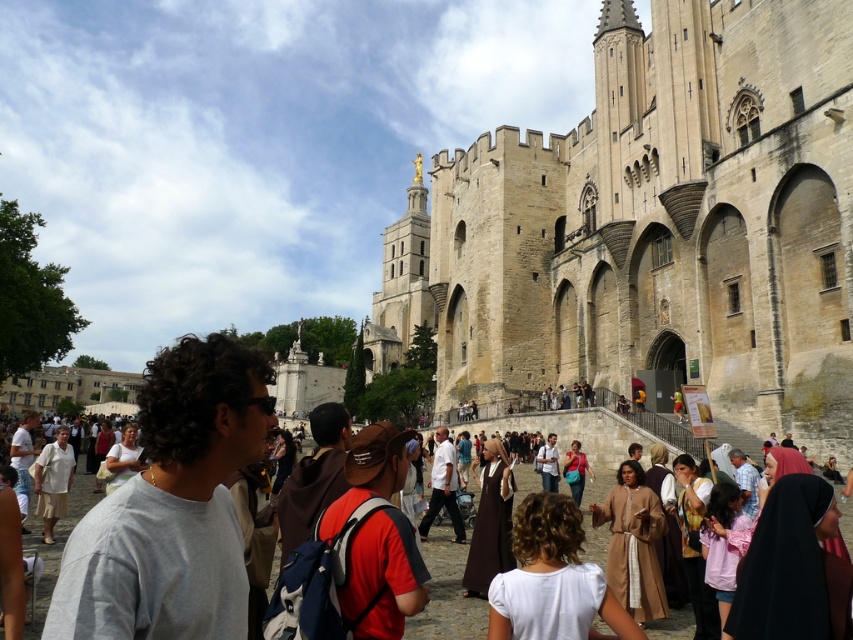
Which is above, beige stone church at center or gray cotton t-shirt at center?

beige stone church at center is higher up.

Is beige stone church at center bigger than gray cotton t-shirt at center?

Yes, beige stone church at center is bigger than gray cotton t-shirt at center.

Does point (675, 180) come farther from viewer compared to point (160, 522)?

Yes, it is.

Find the location of a particular element. This screenshot has width=853, height=640. beige stone church at center is located at coordinates (656, 227).

Who is higher up, gray cotton t-shirt at center or matte red dress at center?

gray cotton t-shirt at center

In the scene shown: Is the position of gray cotton t-shirt at center more distant than that of matte red dress at center?

No, gray cotton t-shirt at center is in front of matte red dress at center.

What do you see at coordinates (172, 508) in the screenshot? I see `gray cotton t-shirt at center` at bounding box center [172, 508].

Where is `gray cotton t-shirt at center`? The height and width of the screenshot is (640, 853). gray cotton t-shirt at center is located at coordinates (172, 508).

Is gray cotton t-shirt at center closer to camera compared to red fabric backpack at center?

Yes, gray cotton t-shirt at center is closer to the viewer.

Which of these two, gray cotton t-shirt at center or red fabric backpack at center, stands taller?

Standing taller between the two is gray cotton t-shirt at center.

Locate an element on the screen. The width and height of the screenshot is (853, 640). gray cotton t-shirt at center is located at coordinates (172, 508).

The image size is (853, 640). In order to click on gray cotton t-shirt at center in this screenshot , I will do `click(172, 508)`.